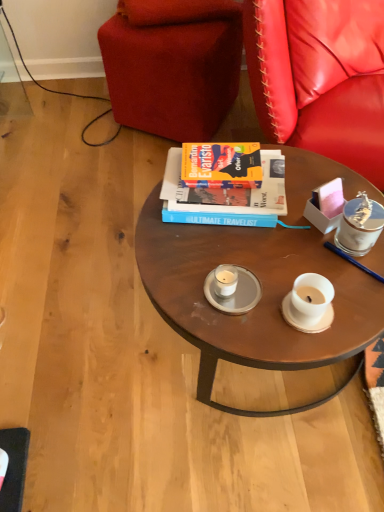
Where is `vacant area located to the right-hand side of white matte candle at center, marked as the 1th coffee cup in a left-to-right arrangement`? vacant area located to the right-hand side of white matte candle at center, marked as the 1th coffee cup in a left-to-right arrangement is located at coordinates (299, 274).